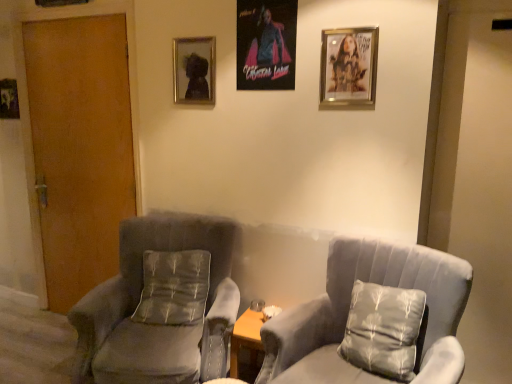
Question: Is metallic silver picture frame at left, the 4th picture frame in the front-to-back sequence, further to the viewer compared to metallic silver picture frame at upper center, positioned as the 2th picture frame in back-to-front order?

Choices:
 (A) yes
 (B) no

Answer: (A)

Question: Is metallic silver picture frame at left, the 4th picture frame in the front-to-back sequence, at the right side of metallic silver picture frame at upper center, which appears as the second picture frame when viewed from the left?

Choices:
 (A) no
 (B) yes

Answer: (A)

Question: From the image's perspective, is metallic silver picture frame at left, which appears as the first picture frame when viewed from the left, under metallic silver picture frame at upper center, positioned as the 2th picture frame in back-to-front order?

Choices:
 (A) yes
 (B) no

Answer: (A)

Question: Can you confirm if metallic silver picture frame at left, the fourth picture frame when ordered from right to left, is wider than metallic silver picture frame at upper center, arranged as the 3th picture frame when viewed from the right?

Choices:
 (A) yes
 (B) no

Answer: (B)

Question: Can you confirm if metallic silver picture frame at left, the fourth picture frame when ordered from right to left, is taller than metallic silver picture frame at upper center, arranged as the 3th picture frame when viewed from the right?

Choices:
 (A) no
 (B) yes

Answer: (A)

Question: Is velvet gray armchair at left, which is the second chair from right to left, taller or shorter than metallic poster at center, which ranks as the 2th picture frame in right-to-left order?

Choices:
 (A) short
 (B) tall

Answer: (B)

Question: Is velvet gray armchair at left, the first chair viewed from the left, in front of or behind metallic poster at center, the 2th picture frame in the front-to-back sequence, in the image?

Choices:
 (A) behind
 (B) front

Answer: (B)

Question: From a real-world perspective, is velvet gray armchair at left, the first chair viewed from the left, positioned above or below metallic poster at center, which ranks as the 2th picture frame in right-to-left order?

Choices:
 (A) below
 (B) above

Answer: (A)

Question: Would you say velvet gray armchair at left, which is the second chair from right to left, is to the left or to the right of metallic poster at center, which is the third picture frame from left to right, in the picture?

Choices:
 (A) left
 (B) right

Answer: (A)

Question: Is suede gray chair at center, arranged as the 2th chair when viewed from the left, wider or thinner than silky gray pillow at center, acting as the second pillow starting from the front?

Choices:
 (A) wide
 (B) thin

Answer: (A)

Question: Do you think suede gray chair at center, acting as the 1th chair starting from the right, is within silky gray pillow at center, acting as the second pillow starting from the front, or outside of it?

Choices:
 (A) outside
 (B) inside

Answer: (A)

Question: Relative to silky gray pillow at center, acting as the second pillow starting from the front, is suede gray chair at center, acting as the 1th chair starting from the right, in front or behind?

Choices:
 (A) behind
 (B) front

Answer: (B)

Question: From a real-world perspective, is suede gray chair at center, acting as the 1th chair starting from the right, physically located above or below silky gray pillow at center, which ranks as the 1th pillow in left-to-right order?

Choices:
 (A) above
 (B) below

Answer: (B)

Question: From a real-world perspective, is velvet gray armchair at left, the first chair viewed from the left, above or below metallic silver picture frame at upper center, which appears as the second picture frame when viewed from the left?

Choices:
 (A) above
 (B) below

Answer: (B)

Question: Considering the relative positions of velvet gray armchair at left, the first chair viewed from the left, and metallic silver picture frame at upper center, arranged as the 3th picture frame when viewed from the right, in the image provided, is velvet gray armchair at left, the first chair viewed from the left, to the left or to the right of metallic silver picture frame at upper center, arranged as the 3th picture frame when viewed from the right,?

Choices:
 (A) right
 (B) left

Answer: (B)